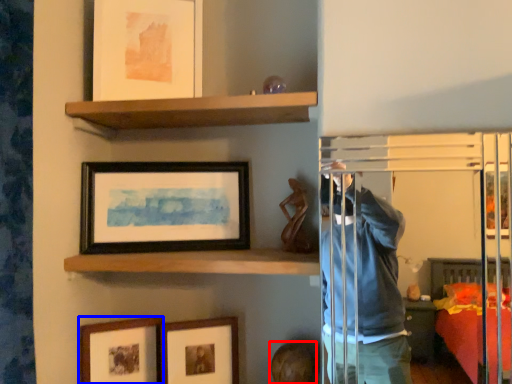
Question: Which of the following is the closest to the observer, head (highlighted by a red box) or picture frame (highlighted by a blue box)?

Choices:
 (A) head
 (B) picture frame

Answer: (A)